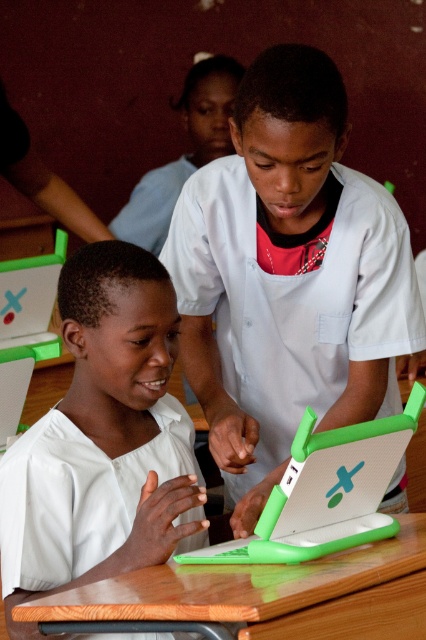
Question: Does matte white shirt at center appear over green wood table at center?

Choices:
 (A) yes
 (B) no

Answer: (A)

Question: Which of the following is the farthest from the observer?

Choices:
 (A) white matte shirt at center
 (B) green plastic laptop at center
 (C) matte white shirt at center
 (D) green wood table at center

Answer: (C)

Question: Which point is farther to the camera?

Choices:
 (A) (305, 524)
 (B) (150, 177)
 (C) (187, 497)

Answer: (B)

Question: Does white matte shirt at center have a greater width compared to white glossy laptop at upper center?

Choices:
 (A) yes
 (B) no

Answer: (B)

Question: Among these objects, which one is nearest to the camera?

Choices:
 (A) green wood table at center
 (B) matte white shirt at center
 (C) green plastic laptop at center
 (D) white matte shirt at center

Answer: (A)

Question: In this image, where is matte white shirt at center located relative to green wood table at center?

Choices:
 (A) below
 (B) above

Answer: (B)